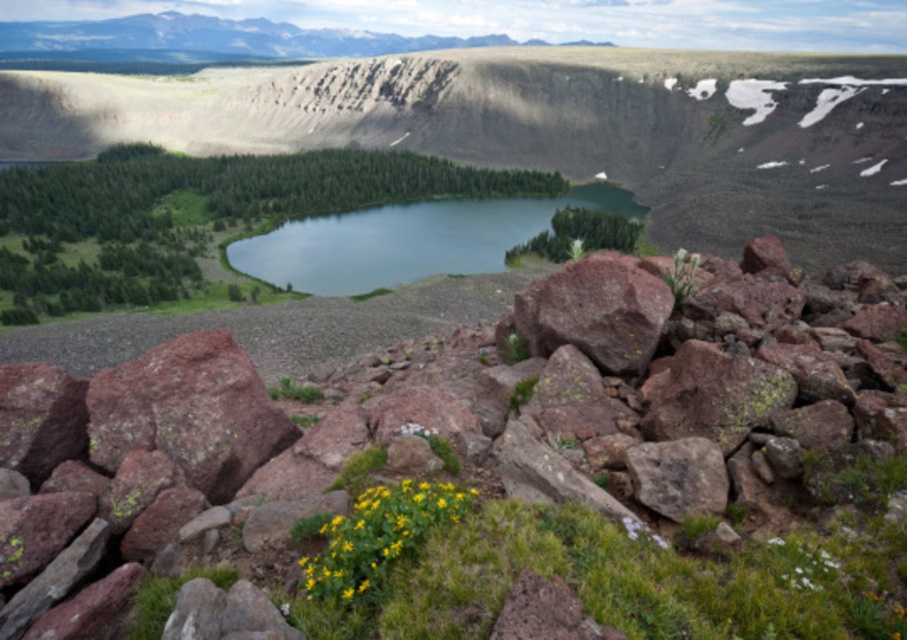
Question: Which of these objects is positioned farthest from the green glossy water at center?

Choices:
 (A) rusty stone boulder at center
 (B) rusty rock at center

Answer: (A)

Question: Where is rusty rock at center located in relation to rusty stone boulder at center in the image?

Choices:
 (A) left
 (B) right

Answer: (A)

Question: Is rusty rock at center to the left of rusty stone boulder at center from the viewer's perspective?

Choices:
 (A) yes
 (B) no

Answer: (A)

Question: Which point appears closest to the camera in this image?

Choices:
 (A) (779, 557)
 (B) (595, 301)
 (C) (441, 496)
 (D) (613, 209)

Answer: (A)

Question: Does green glossy water at center have a lesser width compared to rusty stone boulder at center?

Choices:
 (A) yes
 (B) no

Answer: (B)

Question: Which object is positioned closest to the rusty stone boulder at center?

Choices:
 (A) rusty rock at center
 (B) green glossy water at center
 (C) yellow matte flower at center

Answer: (A)